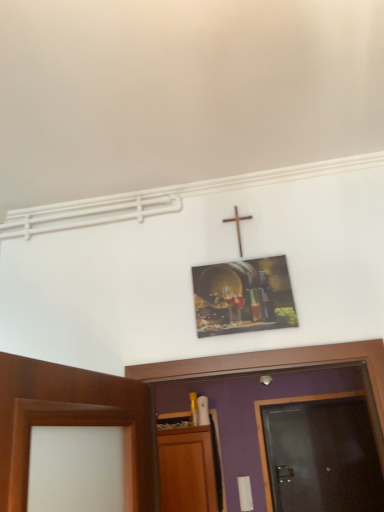
Question: Does dark wood door at right appear on the left side of wooden cross at upper center?

Choices:
 (A) yes
 (B) no

Answer: (B)

Question: Does dark wood door at right have a greater width compared to wooden cross at upper center?

Choices:
 (A) yes
 (B) no

Answer: (A)

Question: Is dark wood door at right closer to the viewer compared to wooden cross at upper center?

Choices:
 (A) yes
 (B) no

Answer: (B)

Question: From a real-world perspective, is dark wood door at right positioned under wooden cross at upper center based on gravity?

Choices:
 (A) yes
 (B) no

Answer: (A)

Question: Does dark wood door at right have a greater height compared to wooden cross at upper center?

Choices:
 (A) no
 (B) yes

Answer: (B)

Question: From a real-world perspective, relative to wooden cross at upper center, is dark wood door at right vertically above or below?

Choices:
 (A) below
 (B) above

Answer: (A)

Question: From the image's perspective, relative to wooden cross at upper center, is dark wood door at right above or below?

Choices:
 (A) below
 (B) above

Answer: (A)

Question: In the image, is dark wood door at right on the left side or the right side of wooden cross at upper center?

Choices:
 (A) left
 (B) right

Answer: (B)

Question: Relative to wooden cross at upper center, is dark wood door at right in front or behind?

Choices:
 (A) behind
 (B) front

Answer: (A)

Question: Considering the relative positions of wooden cross at upper center and metallic wine barrel at upper center in the image provided, is wooden cross at upper center to the left or to the right of metallic wine barrel at upper center?

Choices:
 (A) left
 (B) right

Answer: (A)

Question: Is wooden cross at upper center wider or thinner than metallic wine barrel at upper center?

Choices:
 (A) thin
 (B) wide

Answer: (A)

Question: From a real-world perspective, relative to metallic wine barrel at upper center, is wooden cross at upper center vertically above or below?

Choices:
 (A) above
 (B) below

Answer: (A)

Question: From the image's perspective, relative to metallic wine barrel at upper center, is wooden cross at upper center above or below?

Choices:
 (A) below
 (B) above

Answer: (B)

Question: Considering the positions of metallic wine barrel at upper center and dark wood door at right in the image, is metallic wine barrel at upper center bigger or smaller than dark wood door at right?

Choices:
 (A) small
 (B) big

Answer: (A)

Question: Is metallic wine barrel at upper center taller or shorter than dark wood door at right?

Choices:
 (A) short
 (B) tall

Answer: (A)